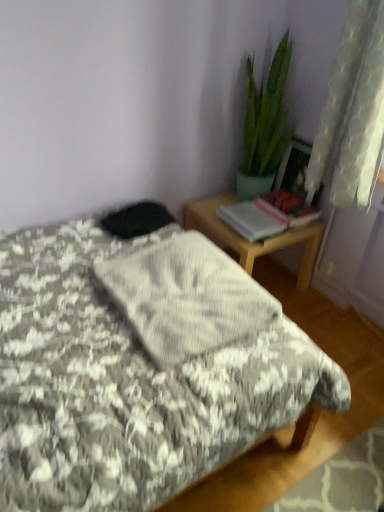
Question: Considering their positions, is gray textured blanket at center located in front of or behind wooden desk at right?

Choices:
 (A) behind
 (B) front

Answer: (B)

Question: In terms of size, does gray textured blanket at center appear bigger or smaller than wooden desk at right?

Choices:
 (A) big
 (B) small

Answer: (B)

Question: Which of these objects is positioned farthest from the white sheer curtain at upper right?

Choices:
 (A) fluffy gray blanket at center
 (B) wooden desk at right
 (C) gray textured blanket at center
 (D) green glossy plant at upper right

Answer: (A)

Question: Which object is the farthest from the fluffy gray blanket at center?

Choices:
 (A) white sheer curtain at upper right
 (B) gray textured blanket at center
 (C) wooden desk at right
 (D) green glossy plant at upper right

Answer: (D)